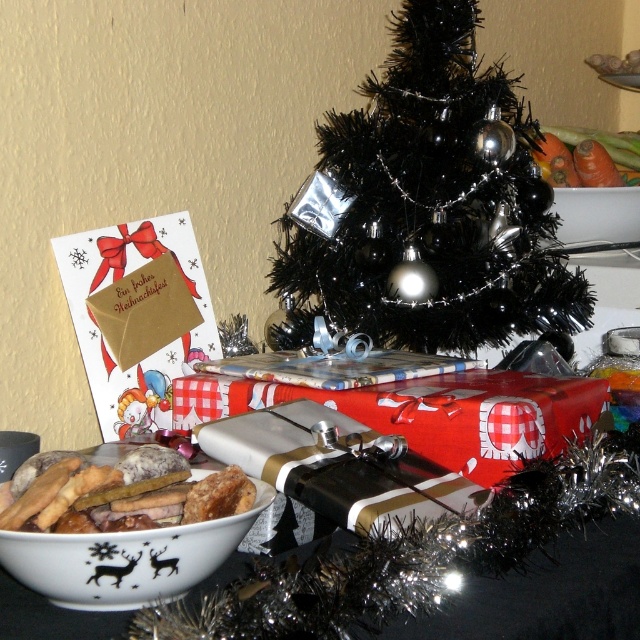
Question: Does white ceramic bowl at lower left have a larger size compared to orange smooth carrots at upper right?

Choices:
 (A) no
 (B) yes

Answer: (A)

Question: Is white ceramic bowl at lower left to the left of golden crumbly cookies at lower left from the viewer's perspective?

Choices:
 (A) no
 (B) yes

Answer: (A)

Question: Among these points, which one is farthest from the camera?

Choices:
 (A) (x=589, y=198)
 (B) (x=42, y=515)
 (C) (x=156, y=568)
 (D) (x=628, y=148)

Answer: (D)

Question: Which object is positioned closest to the white glossy bowl at upper center?

Choices:
 (A) golden crumbly cookies at lower left
 (B) orange smooth carrots at upper right

Answer: (B)

Question: Can you confirm if white ceramic bowl at lower left is positioned below white glossy bowl at upper center?

Choices:
 (A) no
 (B) yes

Answer: (B)

Question: Which point is closer to the camera?

Choices:
 (A) orange smooth carrots at upper right
 (B) black shiny christmas tree at center

Answer: (B)